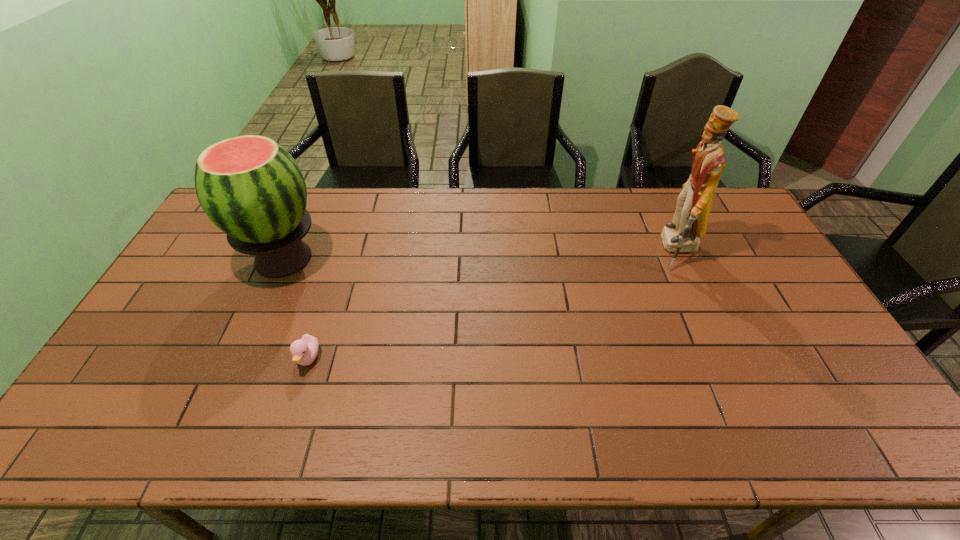
Identify the location of vacant space that is in between the nutcracker and the duckling. The height and width of the screenshot is (540, 960). (492, 304).

Identify the location of unoccupied area between the second tallest object and the second object from right to left. The width and height of the screenshot is (960, 540). (296, 309).

The width and height of the screenshot is (960, 540). I want to click on unoccupied position between the tallest object and the second object from right to left, so click(492, 304).

The image size is (960, 540). What are the coordinates of `vacant point located between the nutcracker and the leftmost object` in the screenshot? It's located at (480, 254).

Identify the location of free area in between the rightmost object and the watermelon. (480, 254).

I want to click on the second closest object to the second shortest object, so pyautogui.click(x=689, y=223).

Locate which object is the closest to the second tallest object. Please provide its 2D coordinates. Your answer should be formatted as a tuple, i.e. [(x, y)], where the tuple contains the x and y coordinates of a point satisfying the conditions above.

[(304, 351)]

I want to click on vacant space that satisfies the following two spatial constraints: 1. on the front-facing side of the tallest object; 2. on the front-facing side of the duckling, so click(x=727, y=358).

At what (x,y) coordinates should I click in order to perform the action: click on vacant space that satisfies the following two spatial constraints: 1. on the front-facing side of the nutcracker; 2. on the front-facing side of the shortest object. Please return your answer as a coordinate pair (x, y). This screenshot has height=540, width=960. Looking at the image, I should click on (727, 358).

The height and width of the screenshot is (540, 960). I want to click on free space that satisfies the following two spatial constraints: 1. on the front-facing side of the nutcracker; 2. on the front-facing side of the duckling, so click(727, 358).